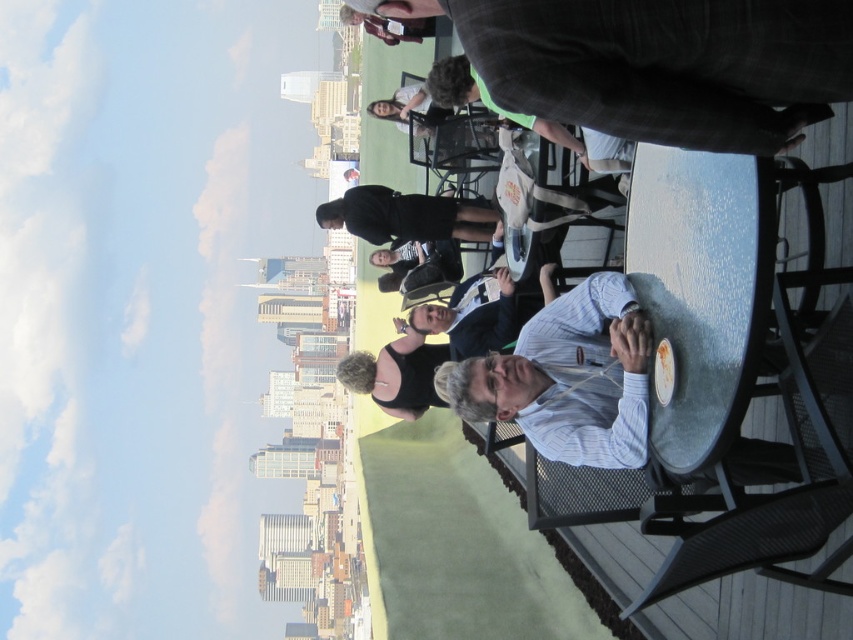
Question: Can you confirm if dark gray suit at upper right is smaller than white striped shirt at center?

Choices:
 (A) no
 (B) yes

Answer: (A)

Question: Is white striped shirt at center closer to the viewer compared to striped shirt at center?

Choices:
 (A) yes
 (B) no

Answer: (A)

Question: Which object is the farthest from the striped shirt at center?

Choices:
 (A) black matte shirt at center
 (B) dark gray suit at upper right
 (C) white striped shirt at center

Answer: (B)

Question: Which of these objects is positioned closest to the striped shirt at center?

Choices:
 (A) black matte shirt at center
 (B) dark gray suit at upper right
 (C) white striped shirt at center

Answer: (A)

Question: Which of these objects is positioned closest to the black matte shirt at center?

Choices:
 (A) white striped shirt at center
 (B) dark gray suit at upper right

Answer: (A)

Question: Is dark gray suit at upper right smaller than white striped shirt at center?

Choices:
 (A) yes
 (B) no

Answer: (B)